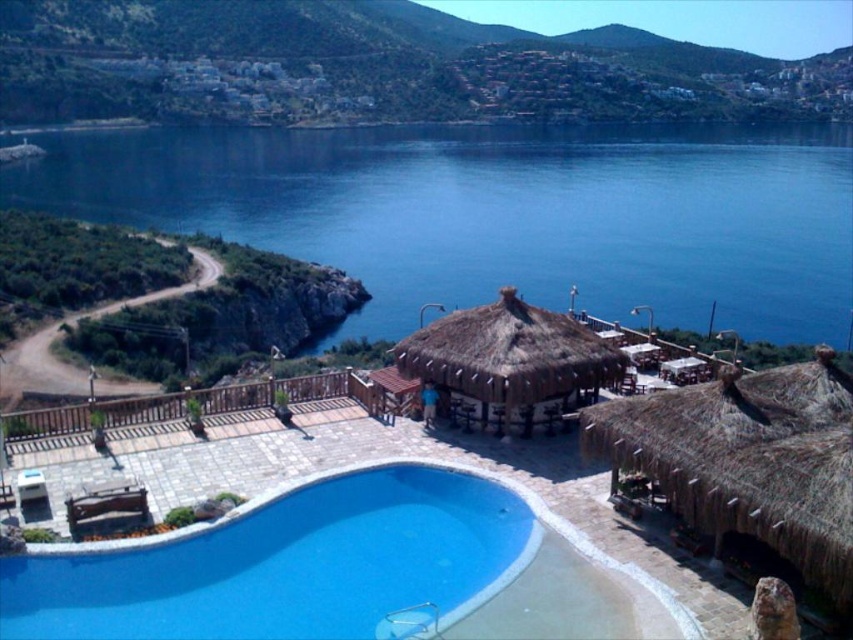
Question: Which object appears farthest from the camera in this image?

Choices:
 (A) blue smooth pool at center
 (B) blue water at upper center
 (C) thatched straw hut at lower right

Answer: (B)

Question: Which point is farther to the camera?

Choices:
 (A) (457, 268)
 (B) (231, 524)

Answer: (A)

Question: Does blue water at upper center appear on the right side of blue smooth pool at center?

Choices:
 (A) no
 (B) yes

Answer: (B)

Question: Which object appears closest to the camera in this image?

Choices:
 (A) thatched straw hut at lower right
 (B) blue water at upper center
 (C) brown thatch hut at center
 (D) blue smooth pool at center

Answer: (A)

Question: Considering the relative positions of blue water at upper center and thatched straw hut at lower right in the image provided, where is blue water at upper center located with respect to thatched straw hut at lower right?

Choices:
 (A) above
 (B) below

Answer: (A)

Question: Considering the relative positions of blue water at upper center and thatched straw hut at lower right in the image provided, where is blue water at upper center located with respect to thatched straw hut at lower right?

Choices:
 (A) above
 (B) below

Answer: (A)